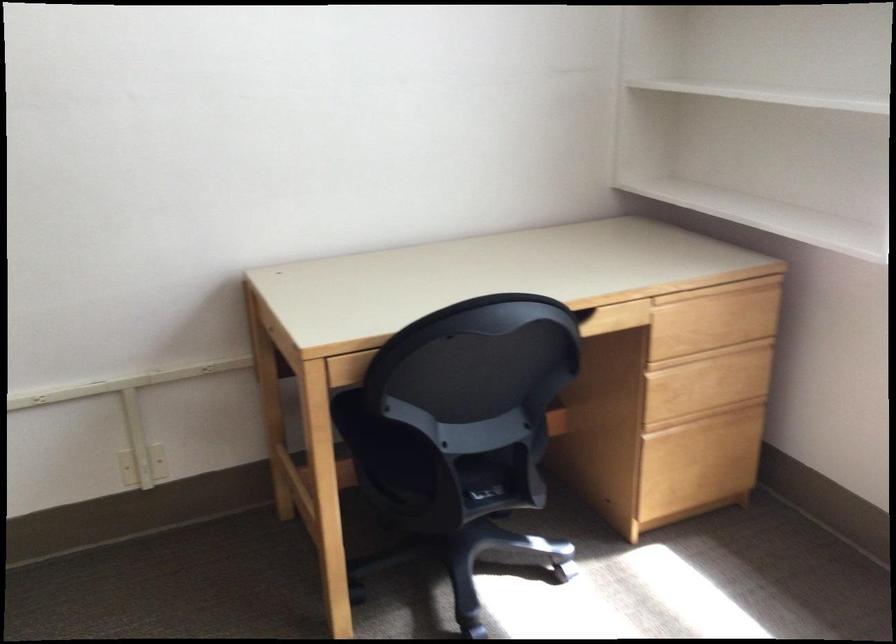
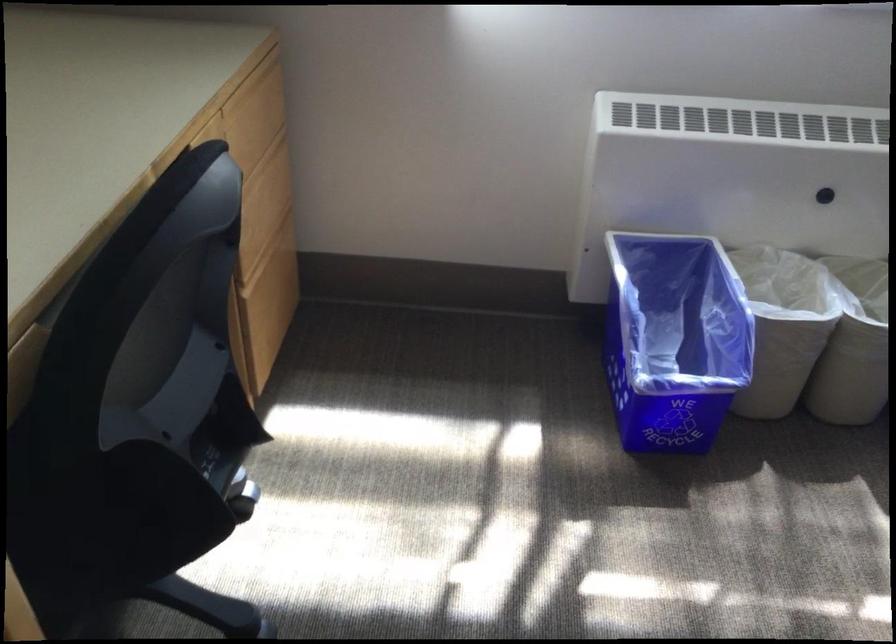
The first image is from the beginning of the video and the second image is from the end. How did the camera likely rotate when shooting the video?

The rotation direction of the camera is right-down.